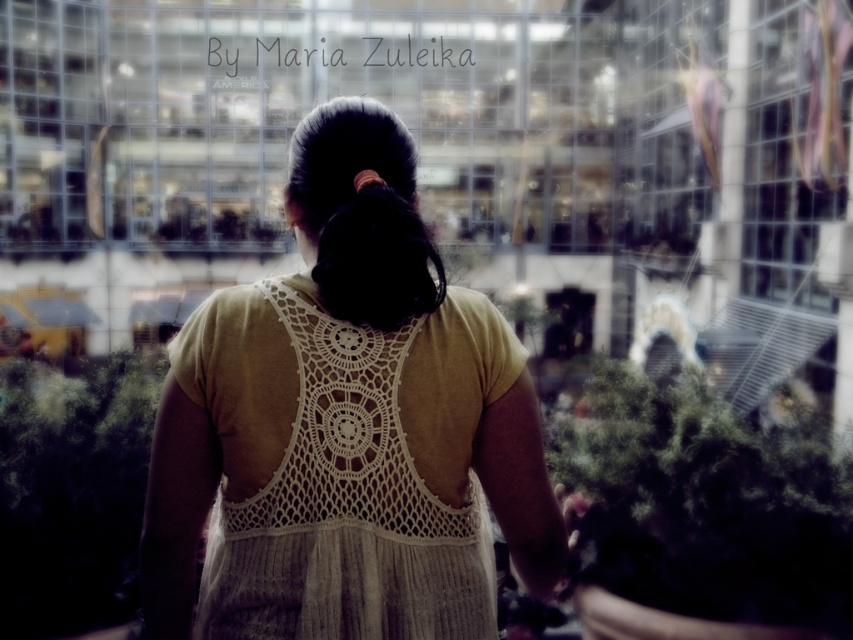
Does green leafy plant at lower left lie behind black silky hair at center?

Yes, it is.

Is green leafy plant at lower left to the right of black silky hair at center from the viewer's perspective?

Incorrect, green leafy plant at lower left is not on the right side of black silky hair at center.

Which is in front, point (51, 419) or point (358, 320)?

Point (358, 320)

Find the location of `green leafy plant at lower left`. green leafy plant at lower left is located at coordinates (73, 492).

Between white crochet dress at center and green leafy plant at lower left, which one is positioned higher?

white crochet dress at center is higher up.

Does white crochet dress at center appear on the right side of green leafy plant at lower left?

Yes, white crochet dress at center is to the right of green leafy plant at lower left.

Is point (248, 310) farther from camera compared to point (111, 568)?

No, (248, 310) is closer to viewer.

Where is `white crochet dress at center`? white crochet dress at center is located at coordinates (344, 465).

Does green fuzzy plant at lower right come behind green leafy plant at lower left?

That is True.

Is green fuzzy plant at lower right positioned before green leafy plant at lower left?

No, green fuzzy plant at lower right is behind green leafy plant at lower left.

Who is more forward, [641,488] or [119,528]?

Positioned in front is point [119,528].

Where is `green fuzzy plant at lower right`? The image size is (853, 640). green fuzzy plant at lower right is located at coordinates (706, 504).